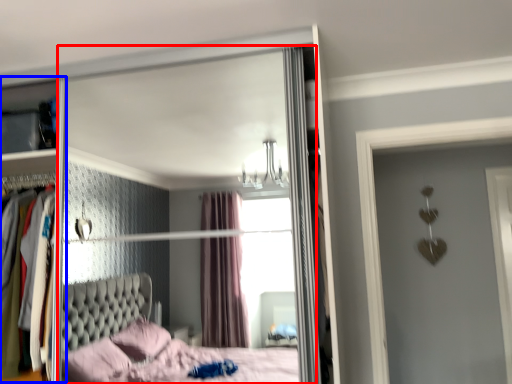
Question: Which of the following is the farthest to the observer, mirror (highlighted by a red box) or dresser (highlighted by a blue box)?

Choices:
 (A) mirror
 (B) dresser

Answer: (B)